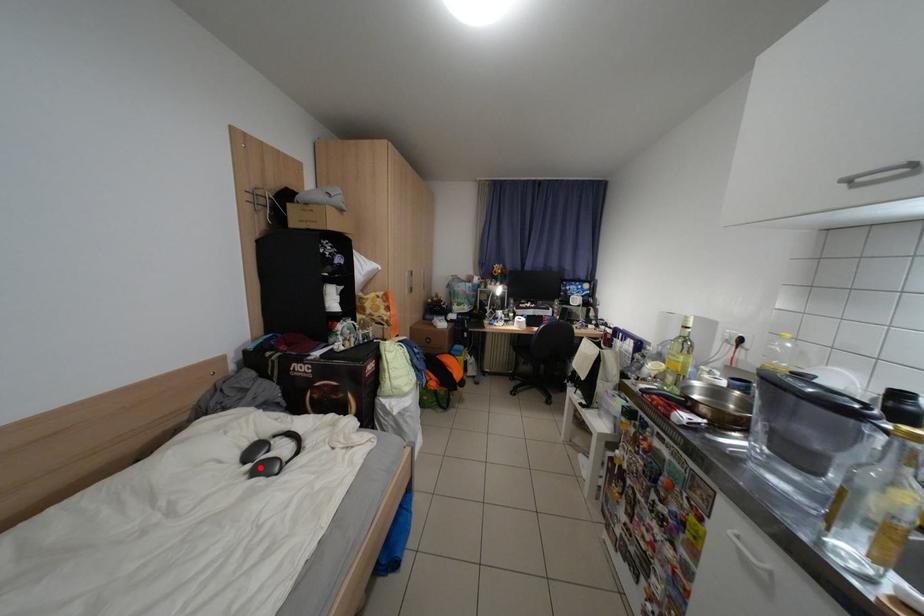
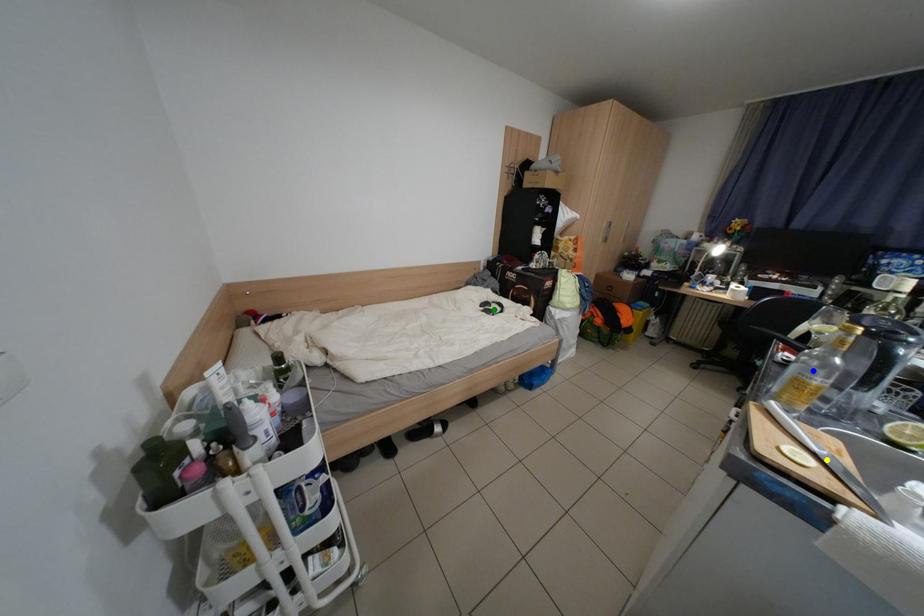
Question: I am providing you with two images of the same scene from different viewpoints. A red point is marked on the first image. You are given multiple points on the second image. Which point in image 2 represents the same 3d spot as the red point in image 1?

Choices:
 (A) blue point
 (B) yellow point
 (C) green point

Answer: (C)